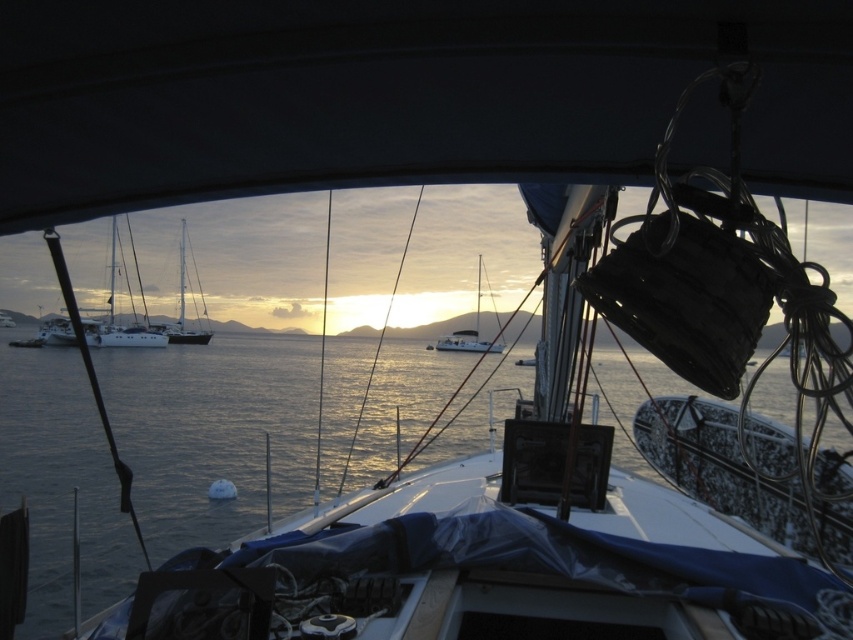
Consider the image. You are standing on the deck of the sailboat and want to locate the glistening silver water at center. According to the coordinates provided, in which direction should you look relative to your position?

You should look towards the center of the image, which corresponds to the coordinates point at (430, 608), to see the glistening silver water at center.

You are standing on the deck of the sailboat and want to reach a point on the deck. You see two points marked as point 1 at coordinates point (186, 330) and point 2 at coordinates point (76, 342). Which point is closer to you when facing forward on the boat?

Point 2 at coordinates point (76, 342) is closer to you because it is in front of point 1 at coordinates point (186, 330) when facing forward on the boat.

You are a sailor on the glistening silver water at center and want to reach the white matte sailboat at left. Can you row your boat there without needing to stop for a break, considering the average rowing speed is 5 meters per minute and you have enough energy for 8 minutes?

The distance between the glistening silver water at center and the white matte sailboat at left is 39.90 meters. At a speed of 5 meters per minute, it would take approximately 8 minutes to cover the distance. Since you have enough energy for 8 minutes, you can reach the white matte sailboat at left without needing to stop for a break.